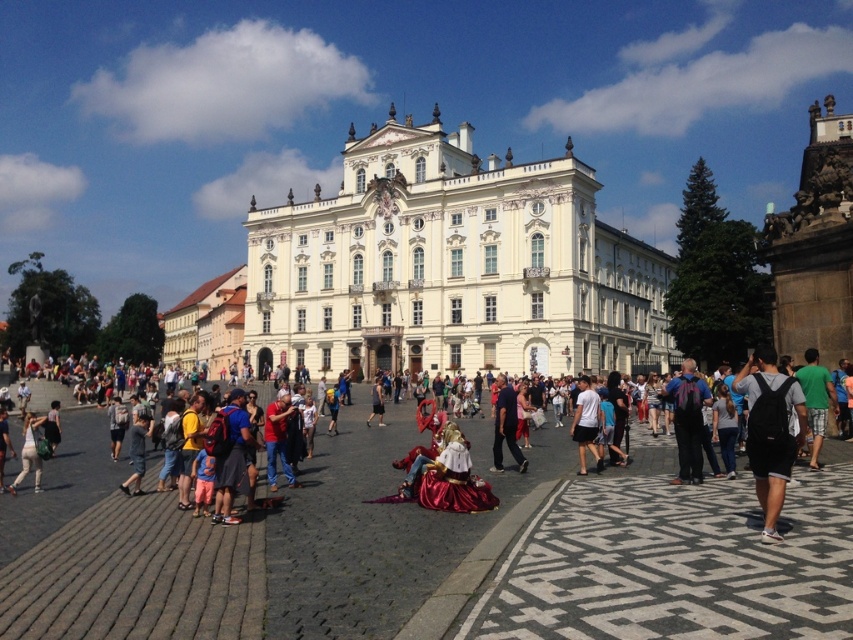
Based on the photo, who is shorter, black backpack at lower right or dark blue fabric at center?

Standing shorter between the two is dark blue fabric at center.

Who is positioned more to the right, black backpack at lower right or dark blue fabric at center?

black backpack at lower right

Is point (764, 486) behind point (379, 396)?

No, (764, 486) is closer to viewer.

I want to click on black backpack at lower right, so click(x=770, y=432).

Is white stone building at center thinner than dark blue shirt at center?

No, white stone building at center is not thinner than dark blue shirt at center.

Who is taller, white stone building at center or dark blue shirt at center?

Standing taller between the two is white stone building at center.

The width and height of the screenshot is (853, 640). Find the location of `white stone building at center`. white stone building at center is located at coordinates (451, 266).

Between smooth stone pavement at center and dark blue fabric at center, which one is positioned lower?

Positioned lower is smooth stone pavement at center.

Who is taller, smooth stone pavement at center or dark blue fabric at center?

smooth stone pavement at center

Does point (288, 586) lie in front of point (375, 394)?

That is True.

This screenshot has width=853, height=640. I want to click on smooth stone pavement at center, so click(430, 552).